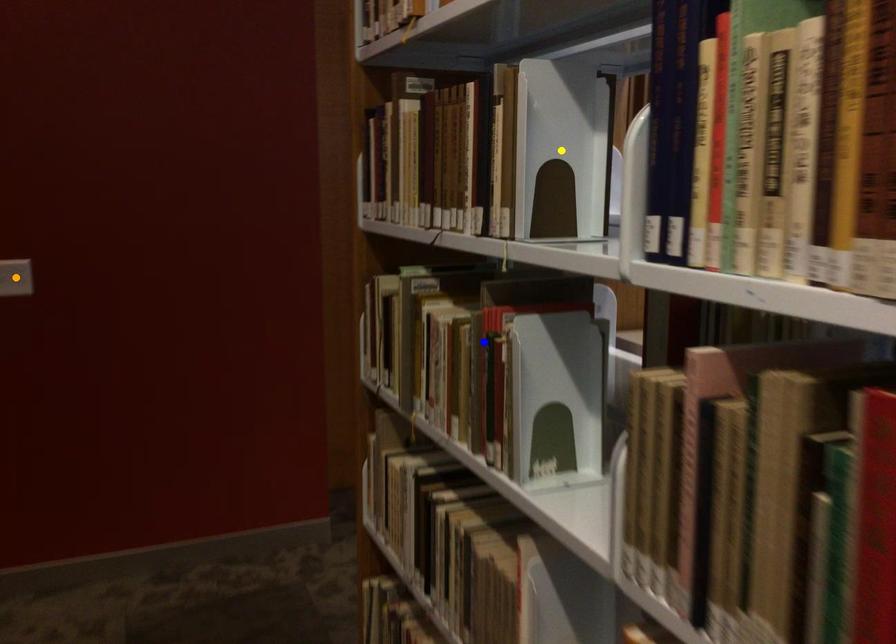
Consider the image. Order these from nearest to farthest:
- orange point
- yellow point
- blue point

yellow point < blue point < orange point